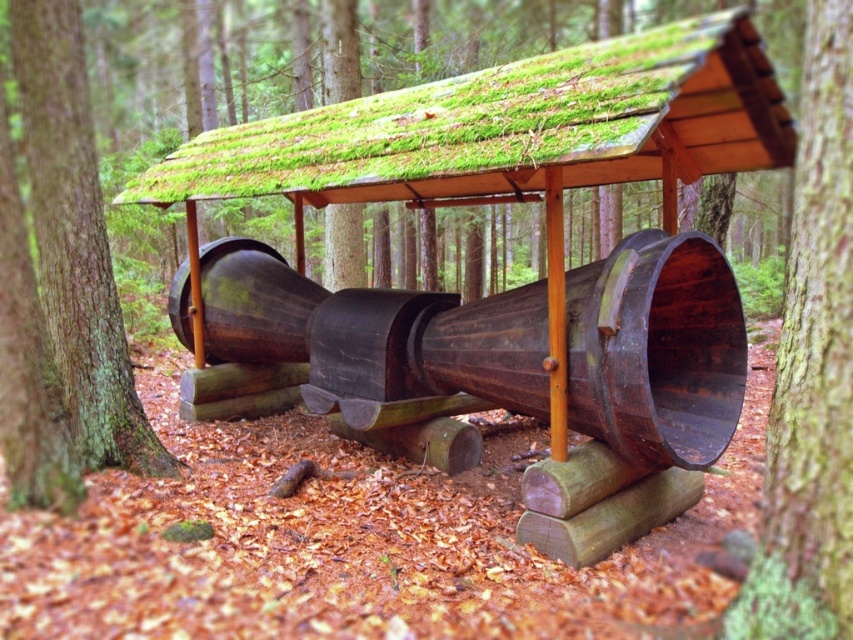
Who is lower down, green mossy bark at center or brown wood tree trunk at left?

green mossy bark at center is below.

Does green mossy bark at center appear under brown wood tree trunk at left?

Yes, green mossy bark at center is below brown wood tree trunk at left.

Is point (764, 477) closer to camera compared to point (112, 276)?

That is True.

The height and width of the screenshot is (640, 853). I want to click on green mossy bark at center, so 811,369.

Does green mossy roof at center appear over green mossy bark at center?

Correct, green mossy roof at center is located above green mossy bark at center.

Which is above, green mossy roof at center or green mossy bark at center?

green mossy roof at center is above.

This screenshot has height=640, width=853. Find the location of `green mossy roof at center`. green mossy roof at center is located at coordinates (509, 128).

Which is above, green mossy roof at center or brown wood tree trunk at left?

Positioned higher is green mossy roof at center.

Who is more forward, (384,180) or (86,371)?

Positioned in front is point (384,180).

This screenshot has width=853, height=640. Identify the location of green mossy roof at center. (509, 128).